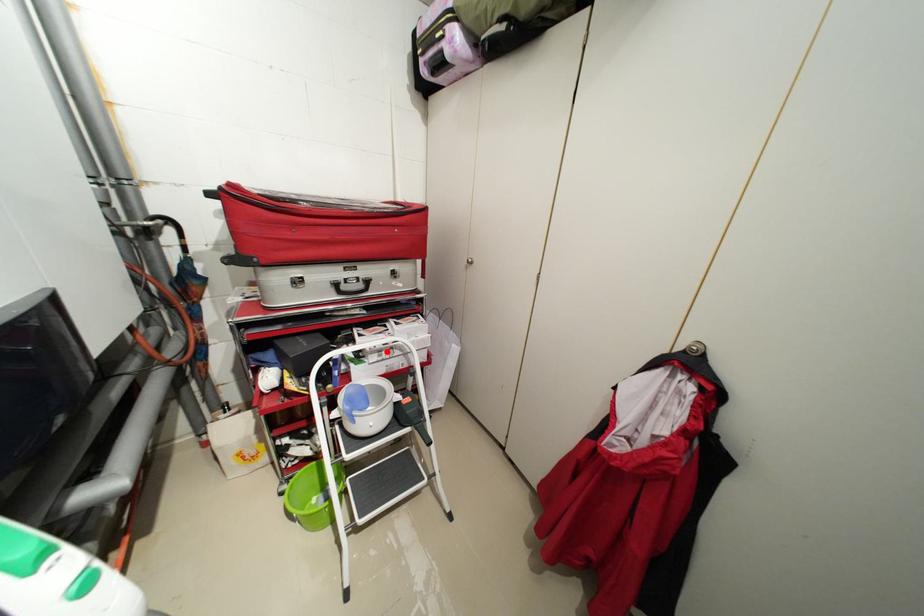
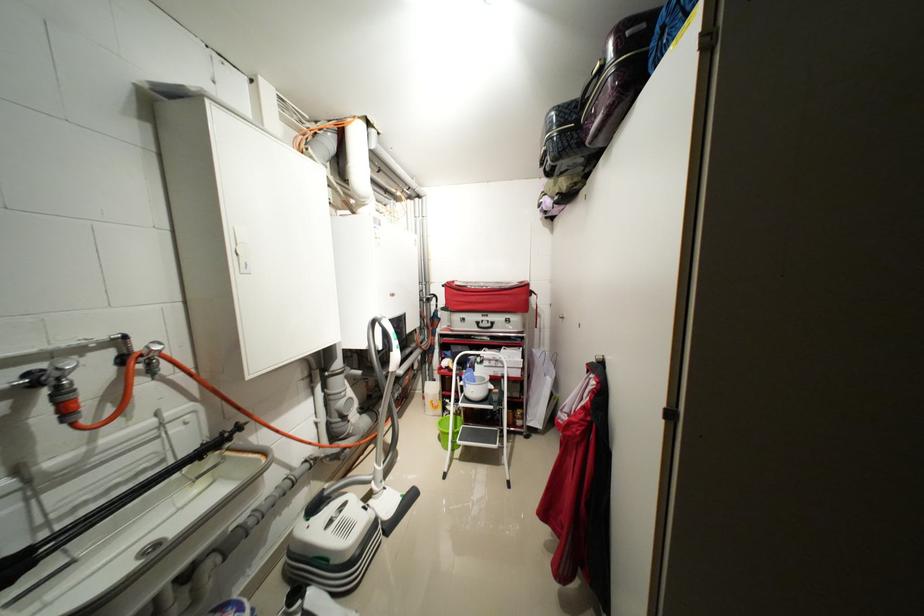
In the second image, find the point that corresponds to the highlighted location in the first image.

(496, 361)